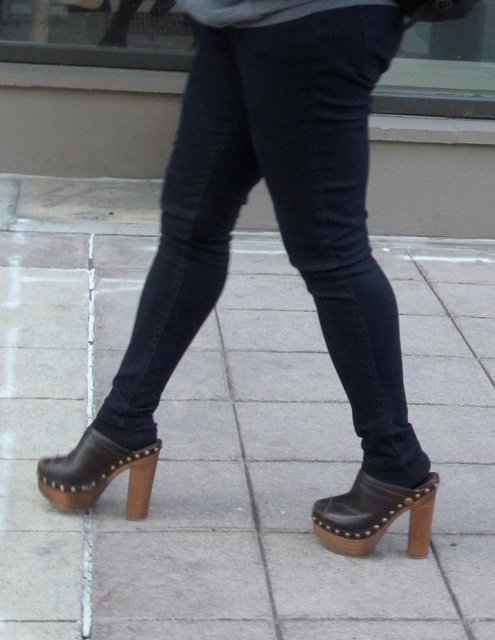
Question: Which object appears farthest from the camera in this image?

Choices:
 (A) brown leather clog at lower left
 (B) brown leather clogs at lower center
 (C) brown leather clog at lower right
 (D) dark blue denim jeans at center

Answer: (A)

Question: Where is brown leather clog at lower right located in relation to brown leather clog at lower left in the image?

Choices:
 (A) below
 (B) above

Answer: (A)

Question: Which of the following is the farthest from the observer?

Choices:
 (A) (419, 355)
 (B) (374, 364)
 (C) (379, 528)

Answer: (A)

Question: Observing the image, what is the correct spatial positioning of dark blue denim jeans at center in reference to brown leather clog at lower right?

Choices:
 (A) right
 (B) left

Answer: (B)

Question: Is brown leather clog at lower right smaller than brown leather clog at lower left?

Choices:
 (A) yes
 (B) no

Answer: (B)

Question: Which of these objects is positioned farthest from the brown leather clog at lower right?

Choices:
 (A) dark blue denim jeans at center
 (B) brown leather clogs at lower center

Answer: (B)